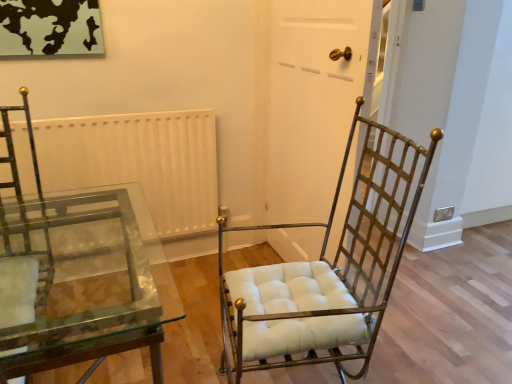
Question: Is white matte radiator at upper center not within white matte door at center?

Choices:
 (A) yes
 (B) no

Answer: (A)

Question: Are white matte radiator at upper center and white matte door at center making contact?

Choices:
 (A) yes
 (B) no

Answer: (B)

Question: From a real-world perspective, is white matte radiator at upper center over white matte door at center?

Choices:
 (A) no
 (B) yes

Answer: (A)

Question: Considering the relative sizes of white matte radiator at upper center and white matte door at center in the image provided, is white matte radiator at upper center wider than white matte door at center?

Choices:
 (A) yes
 (B) no

Answer: (B)

Question: Could white matte door at center be considered to be inside white matte radiator at upper center?

Choices:
 (A) no
 (B) yes

Answer: (A)

Question: In the image, is white matte door at center on the left side or the right side of transparent glass table at lower left?

Choices:
 (A) right
 (B) left

Answer: (A)

Question: Relative to transparent glass table at lower left, is white matte door at center in front or behind?

Choices:
 (A) front
 (B) behind

Answer: (B)

Question: Is point (323, 145) positioned closer to the camera than point (17, 342)?

Choices:
 (A) farther
 (B) closer

Answer: (A)

Question: Considering the positions of white matte door at center and transparent glass table at lower left in the image, is white matte door at center bigger or smaller than transparent glass table at lower left?

Choices:
 (A) big
 (B) small

Answer: (B)

Question: Would you say gold metal/texture chair at center is to the left or to the right of white matte radiator at upper center in the picture?

Choices:
 (A) left
 (B) right

Answer: (B)

Question: Is gold metal/texture chair at center in front of or behind white matte radiator at upper center in the image?

Choices:
 (A) behind
 (B) front

Answer: (B)

Question: Does point (301, 301) appear closer or farther from the camera than point (186, 122)?

Choices:
 (A) closer
 (B) farther

Answer: (A)

Question: Choose the correct answer: Is gold metal/texture chair at center inside white matte radiator at upper center or outside it?

Choices:
 (A) inside
 (B) outside

Answer: (B)

Question: In terms of size, does transparent glass table at lower left appear bigger or smaller than white matte door at center?

Choices:
 (A) small
 (B) big

Answer: (B)

Question: From a real-world perspective, is transparent glass table at lower left above or below white matte door at center?

Choices:
 (A) above
 (B) below

Answer: (B)